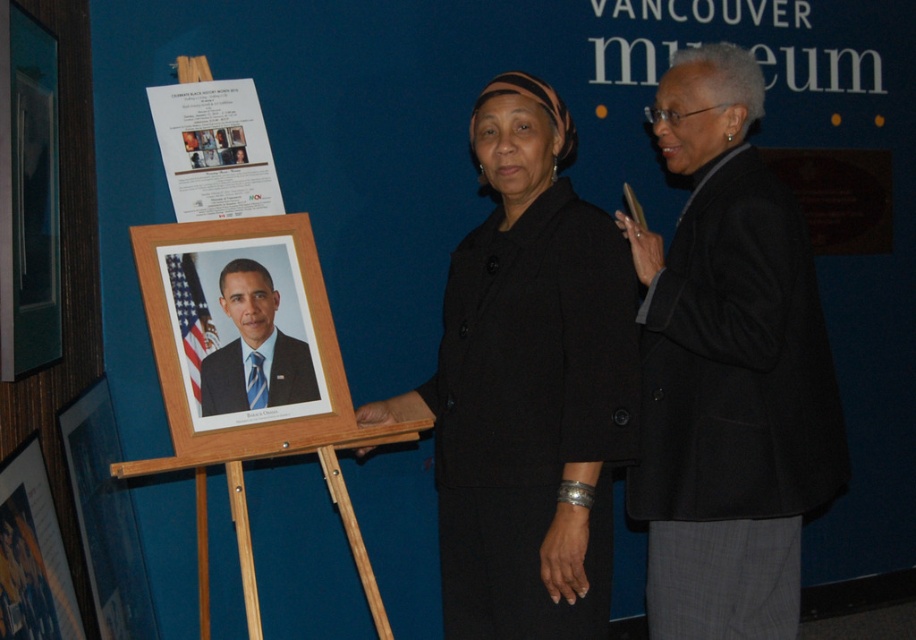
You are at the Vancouver museum exhibit and see the black wool jacket at right. Where exactly is it located in the image?

The black wool jacket at right is located at point (728, 371) in the image.

You are standing in the Vancouver museum exhibit and see the wooden easel with the Barack Obama photo. There is a point marked at coordinates (728, 371). What object is located at that point?

The point at coordinates (728, 371) corresponds to the black wool jacket at right.

You are a tailor who needs to determine if the black wool coat at center and the black wool jacket at right can be hung on a single hanger without overlapping. The hanger has a maximum width of 0.5 inches. Can they be placed together on the hanger?

→ The black wool coat at center and black wool jacket at right are 0.42 inches apart, so yes, they can be placed together on the hanger since the combined width is within the 0.5 inches limit.